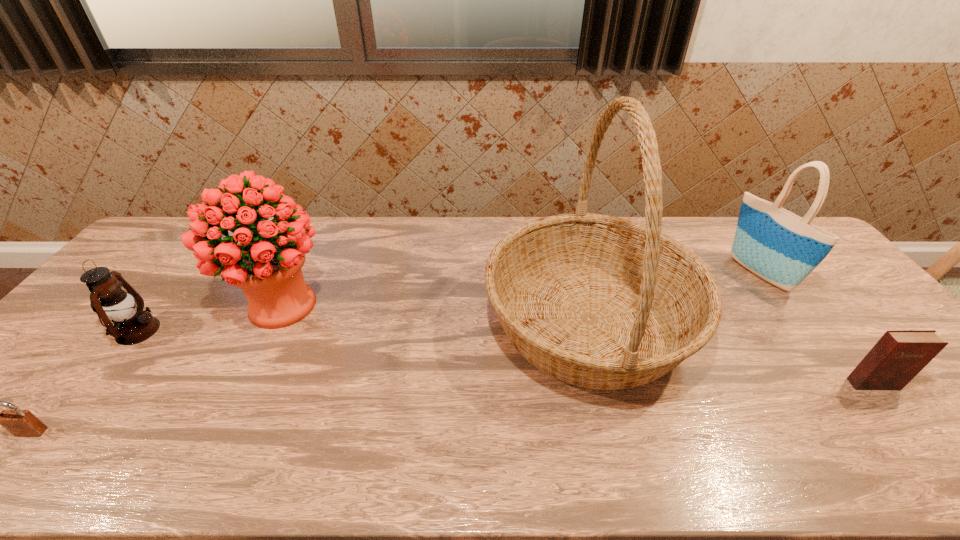
Find the location of a particular element. vacant point located between the basket and the padlock is located at coordinates (310, 376).

I want to click on vacant area that lies between the tallest object and the nearest object, so click(x=310, y=376).

The width and height of the screenshot is (960, 540). Find the location of `vacant area between the third object from right to left and the lantern`. vacant area between the third object from right to left and the lantern is located at coordinates (363, 326).

Where is `vacant space that's between the lantern and the tallest object`? The image size is (960, 540). vacant space that's between the lantern and the tallest object is located at coordinates (363, 326).

What are the coordinates of `blank region between the second shortest object and the lantern` in the screenshot? It's located at (506, 357).

Select which object appears as the fourth closest to the fifth tallest object. Please provide its 2D coordinates. Your answer should be formatted as a tuple, i.e. [(x, y)], where the tuple contains the x and y coordinates of a point satisfying the conditions above.

[(132, 325)]

Locate which object ranks fourth in proximity to the padlock. Please provide its 2D coordinates. Your answer should be formatted as a tuple, i.e. [(x, y)], where the tuple contains the x and y coordinates of a point satisfying the conditions above.

[(782, 248)]

The height and width of the screenshot is (540, 960). I want to click on vacant area that satisfies the following two spatial constraints: 1. on the side of the lantern, there is a wick adjustment knob; 2. on the front-facing side of the shortest object, so click(x=59, y=432).

I want to click on blank space that satisfies the following two spatial constraints: 1. on the side of the third shortest object, there is a wick adjustment knob; 2. on the front-facing side of the shortest object, so click(59, 432).